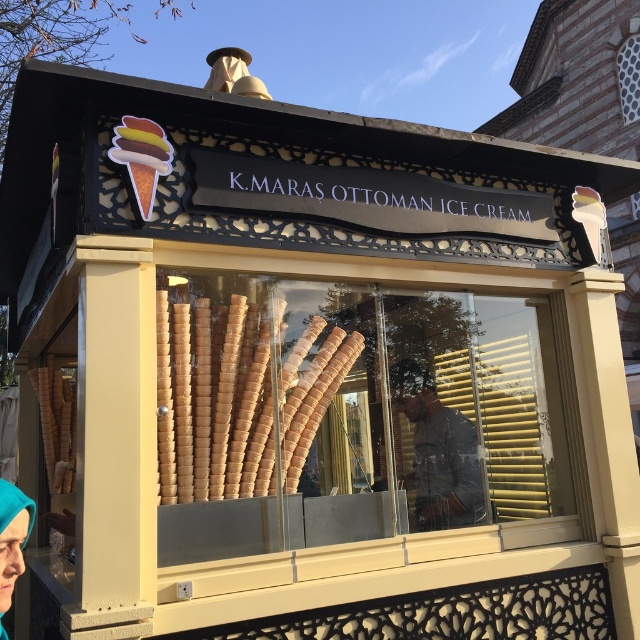
Question: Estimate the real-world distances between objects in this image. Which object is closer to the teal fabric headscarf at lower left?

Choices:
 (A) dark gray fabric at center
 (B) golden waffle cone at center

Answer: (B)

Question: Can you confirm if golden waffle cone at center is positioned to the right of teal fabric headscarf at lower left?

Choices:
 (A) yes
 (B) no

Answer: (A)

Question: Is golden waffle cone at center bigger than teal fabric headscarf at lower left?

Choices:
 (A) yes
 (B) no

Answer: (A)

Question: Which of the following is the closest to the observer?

Choices:
 (A) teal fabric headscarf at lower left
 (B) golden waffle cone at center
 (C) dark gray fabric at center

Answer: (A)

Question: Is dark gray fabric at center closer to camera compared to teal fabric headscarf at lower left?

Choices:
 (A) no
 (B) yes

Answer: (A)

Question: Which object appears farthest from the camera in this image?

Choices:
 (A) teal fabric headscarf at lower left
 (B) golden waffle cone at center
 (C) dark gray fabric at center

Answer: (C)